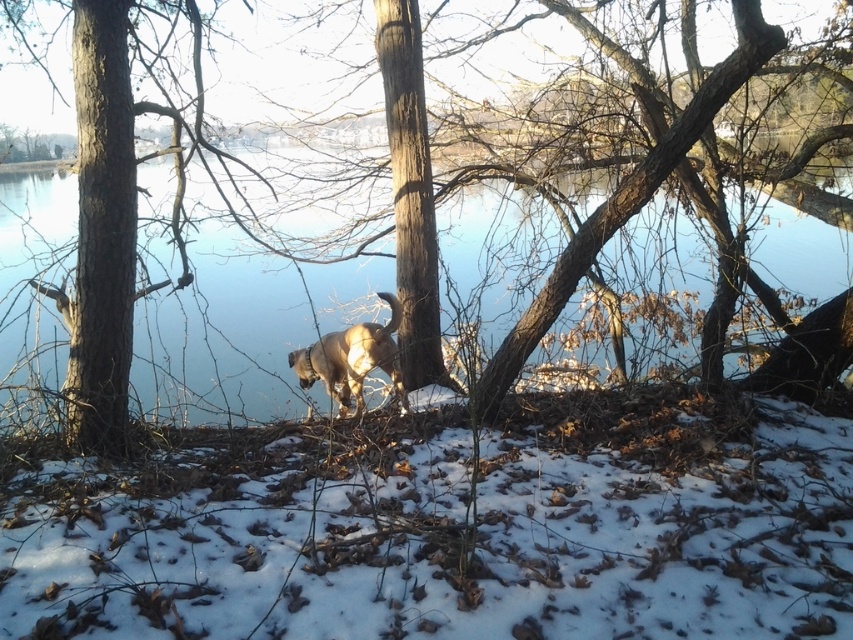
You are planning to build a small snowman using the white fluffy snow at lower center and the clear blue water at center. Which material has a wider area available for your project?

The white fluffy snow at lower center has a wider area available since its width surpasses that of the clear blue water at center.

You are planning to build a snowman using the white fluffy snow at lower center and the brown rough tree at center. Which object would be more suitable for building the snowman?

The white fluffy snow at lower center is more suitable for building a snowman because it is larger in size than the brown rough tree at center.

You are a small dog that is 1 foot tall. You want to jump from the white fluffy snow at lower center to the clear blue water at center. Can you make the jump?

The distance between the white fluffy snow at lower center and the clear blue water at center is 8.39 feet. Since the dog is only 1 foot tall, it cannot jump that far. Therefore, the dog cannot make the jump.